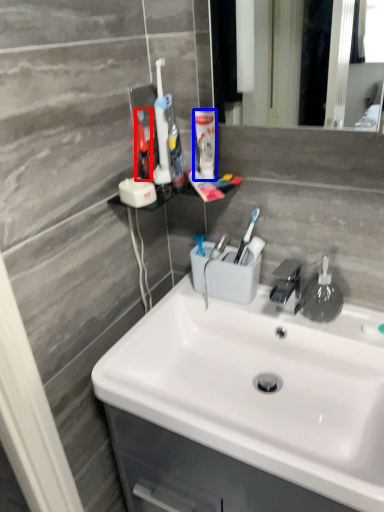
Question: Which of the following is the closest to the observer, toothbrush (highlighted by a red box) or mouthwash (highlighted by a blue box)?

Choices:
 (A) toothbrush
 (B) mouthwash

Answer: (A)